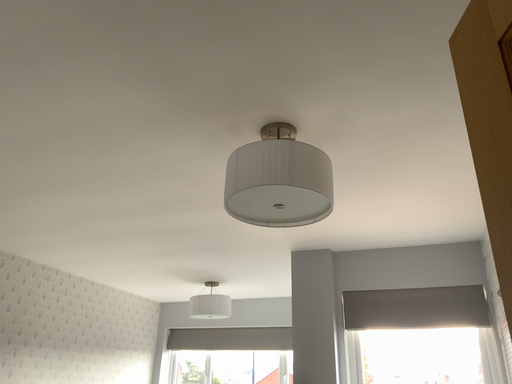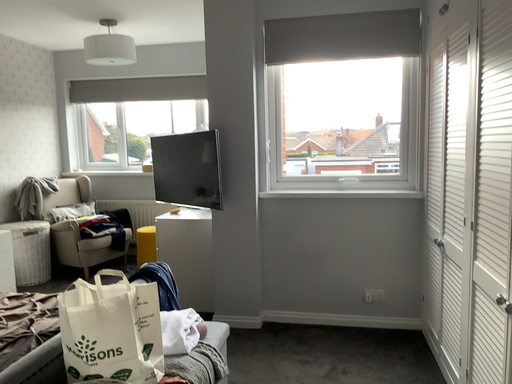
Question: Which way did the camera rotate in the video?

Choices:
 (A) rotated left
 (B) rotated right

Answer: (B)